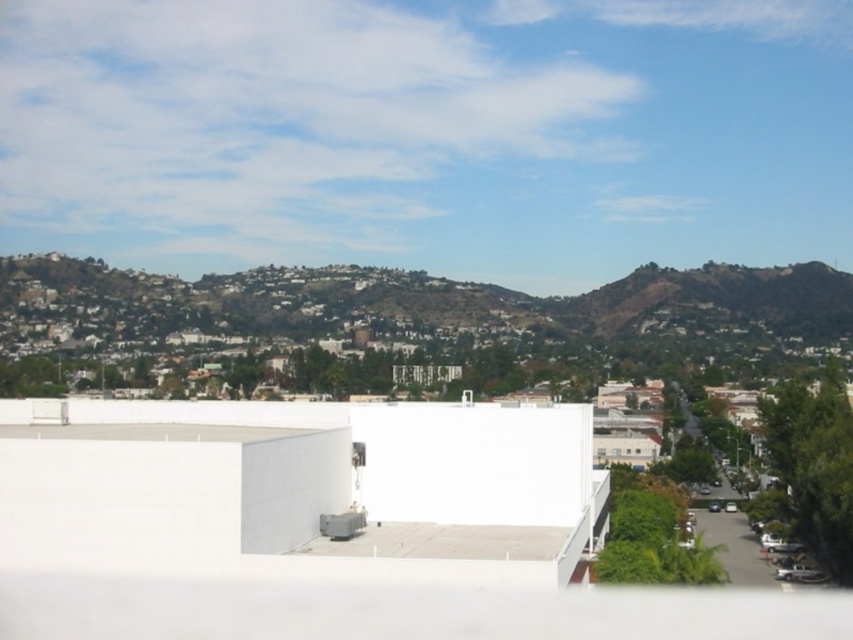
You are a drone operator planning to fly a drone from the white smooth building at center to the green grassy hillside at upper center. Considering their sizes, which object would require more careful navigation due to its size?

The green grassy hillside at upper center requires more careful navigation because it is larger in size compared to the white smooth building at center, making it a bigger target to accurately reach.

You are standing at the origin point of the coordinate system in the image. The white smooth building at center is at coordinates 0.761, 0.353. If you want to walk directly towards it, which direction should you head?

The white smooth building at center is located at coordinates (300, 486). Since the x and y values are both positive, you should head northeast to reach it.

You are a delivery driver planning to drive from the white smooth building at center to the green grassy hillside at upper center. Which direction should you turn to head towards the hillside from the building?

The white smooth building at center is positioned on the right side of green grassy hillside at upper center, so you should turn left to head towards the hillside from the building.